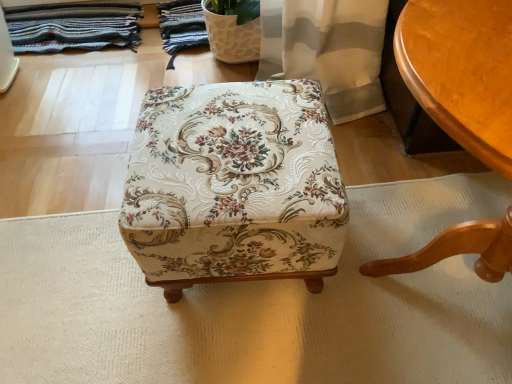
Describe the element at coordinates (73, 27) in the screenshot. The height and width of the screenshot is (384, 512). I see `striped woolen blanket at upper left` at that location.

Where is `floral fabric ottoman at center`? floral fabric ottoman at center is located at coordinates (234, 186).

The width and height of the screenshot is (512, 384). What do you see at coordinates (234, 186) in the screenshot? I see `floral fabric ottoman at center` at bounding box center [234, 186].

The height and width of the screenshot is (384, 512). Find the location of `smooth wooden table at right`. smooth wooden table at right is located at coordinates (462, 71).

Is point (458, 105) positioned in front of point (109, 26)?

Yes, it is.

From the image's perspective, is smooth wooden table at right under striped woolen blanket at upper left?

Correct, smooth wooden table at right appears lower than striped woolen blanket at upper left in the image.

Measure the distance from smooth wooden table at right to striped woolen blanket at upper left.

They are 1.46 meters apart.

This screenshot has height=384, width=512. What are the coordinates of `table lying in front of the striped woolen blanket at upper left` in the screenshot? It's located at (462, 71).

From the image's perspective, is floral fabric ottoman at center beneath smooth wooden table at right?

No, from the image's perspective, floral fabric ottoman at center is not below smooth wooden table at right.

Is floral fabric ottoman at center spatially inside smooth wooden table at right, or outside of it?

floral fabric ottoman at center exists outside the volume of smooth wooden table at right.

Could you tell me if floral fabric ottoman at center is turned towards smooth wooden table at right?

Yes, floral fabric ottoman at center is aimed at smooth wooden table at right.

Would you say floral fabric ottoman at center is inside or outside striped woolen blanket at upper left?

floral fabric ottoman at center is located beyond the bounds of striped woolen blanket at upper left.

I want to click on blanket located underneath the floral fabric ottoman at center (from a real-world perspective), so click(x=73, y=27).

Based on the photo, what's the angular difference between floral fabric ottoman at center and striped woolen blanket at upper left's facing directions?

89.9 degrees.

Is floral fabric ottoman at center thinner than striped woolen blanket at upper left?

No.

In the scene shown: Considering the relative sizes of striped woolen blanket at upper left and floral fabric ottoman at center in the image provided, is striped woolen blanket at upper left smaller than floral fabric ottoman at center?

Yes, striped woolen blanket at upper left is smaller than floral fabric ottoman at center.

Between striped woolen blanket at upper left and floral fabric ottoman at center, which one appears on the left side from the viewer's perspective?

Positioned to the left is striped woolen blanket at upper left.

Which is nearer, (53, 46) or (188, 145)?

Point (53, 46).

Do you think striped woolen blanket at upper left is within floral fabric ottoman at center, or outside of it?

striped woolen blanket at upper left cannot be found inside floral fabric ottoman at center.

Is point (53, 11) positioned in front of point (467, 142)?

No.

Which of these two, striped woolen blanket at upper left or smooth wooden table at right, is bigger?

With larger size is smooth wooden table at right.

Looking at this image, is striped woolen blanket at upper left inside the boundaries of smooth wooden table at right, or outside?

striped woolen blanket at upper left cannot be found inside smooth wooden table at right.

I want to click on table lying in front of the striped woolen blanket at upper left, so click(462, 71).

In the scene shown: Would you consider smooth wooden table at right to be distant from floral fabric ottoman at center?

smooth wooden table at right is actually quite close to floral fabric ottoman at center.

Is the position of smooth wooden table at right more distant than that of floral fabric ottoman at center?

No, the depth of smooth wooden table at right is less than that of floral fabric ottoman at center.

This screenshot has width=512, height=384. I want to click on furniture above the smooth wooden table at right (from the image's perspective), so click(x=234, y=186).

Does smooth wooden table at right have a lesser height compared to floral fabric ottoman at center?

In fact, smooth wooden table at right may be taller than floral fabric ottoman at center.

Locate an element on the screen. Image resolution: width=512 pixels, height=384 pixels. table in front of the striped woolen blanket at upper left is located at coordinates (462, 71).

This screenshot has width=512, height=384. What are the coordinates of `furniture behind the smooth wooden table at right` in the screenshot? It's located at (234, 186).

When comparing their distances from floral fabric ottoman at center, does striped woolen blanket at upper left or smooth wooden table at right seem closer?

Among the two, smooth wooden table at right is located nearer to floral fabric ottoman at center.

Considering their positions, is smooth wooden table at right positioned further to striped woolen blanket at upper left than floral fabric ottoman at center?

Among the two, smooth wooden table at right is located further to striped woolen blanket at upper left.

Estimate the real-world distances between objects in this image. Which object is closer to smooth wooden table at right, floral fabric ottoman at center or striped woolen blanket at upper left?

Based on the image, floral fabric ottoman at center appears to be nearer to smooth wooden table at right.

Looking at the image, which one is located further to striped woolen blanket at upper left, floral fabric ottoman at center or smooth wooden table at right?

smooth wooden table at right lies further to striped woolen blanket at upper left than the other object.

Based on their spatial positions, is striped woolen blanket at upper left or floral fabric ottoman at center closer to smooth wooden table at right?

floral fabric ottoman at center lies closer to smooth wooden table at right than the other object.

When comparing their distances from floral fabric ottoman at center, does smooth wooden table at right or striped woolen blanket at upper left seem closer?

smooth wooden table at right is closer to floral fabric ottoman at center.

This screenshot has height=384, width=512. I want to click on furniture positioned between smooth wooden table at right and striped woolen blanket at upper left from near to far, so click(234, 186).